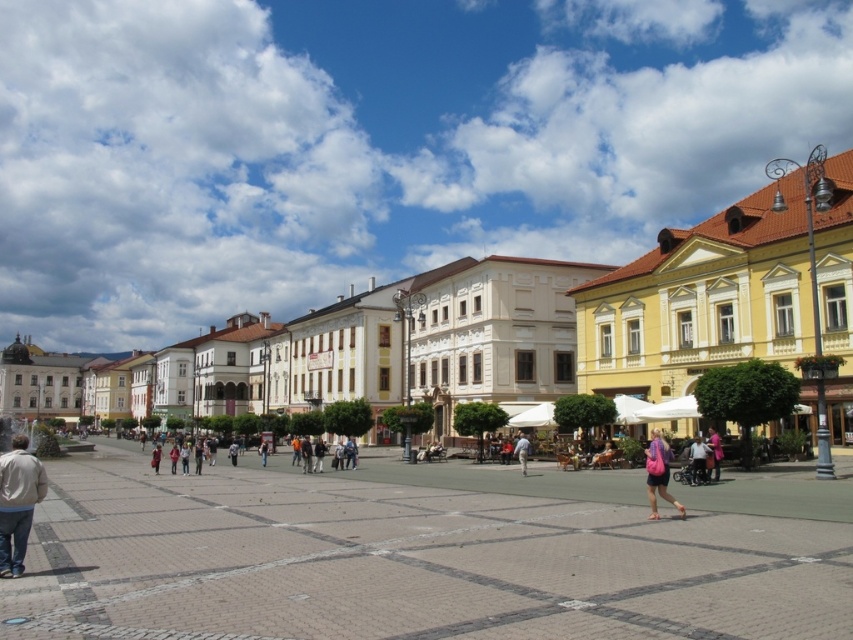
Question: Can you confirm if yellow painted building at center is bigger than light beige jacket at lower left?

Choices:
 (A) yes
 (B) no

Answer: (A)

Question: Which point is farther to the camera?

Choices:
 (A) pink fabric person at lower right
 (B) light blue denim jeans at center
 (C) light beige jacket at lower left

Answer: (B)

Question: Can you confirm if yellow painted building at center is positioned above pink fabric person at lower right?

Choices:
 (A) yes
 (B) no

Answer: (A)

Question: Considering the real-world distances, which object is closest to the yellow painted building at center?

Choices:
 (A) pink fabric person at lower right
 (B) brick paved square at center
 (C) light blue denim jeans at center
 (D) pink fabric bag at center

Answer: (C)

Question: Among these objects, which one is farthest from the camera?

Choices:
 (A) yellow painted building at center
 (B) brick paved square at center

Answer: (A)

Question: Can you confirm if pink fabric bag at center is smaller than light blue denim jeans at center?

Choices:
 (A) yes
 (B) no

Answer: (B)